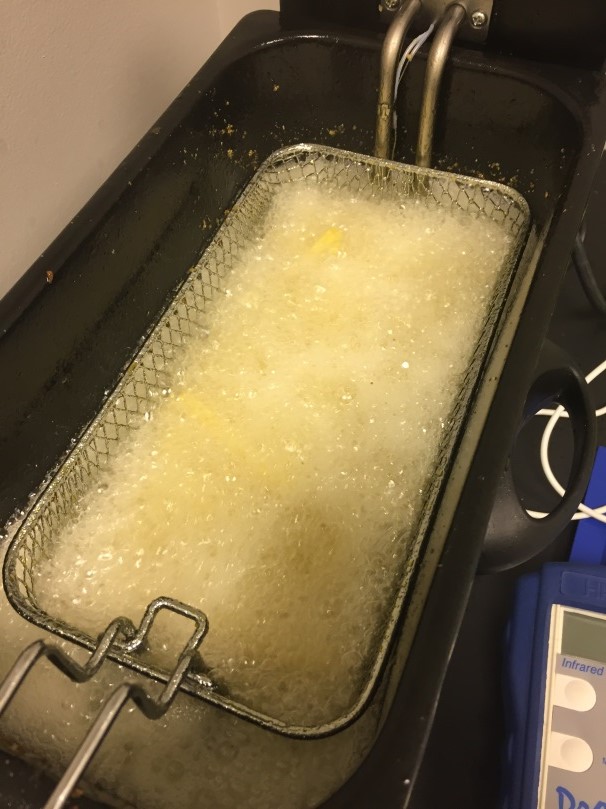
Where is `cast iron pan`? The height and width of the screenshot is (809, 606). cast iron pan is located at coordinates (447, 600).